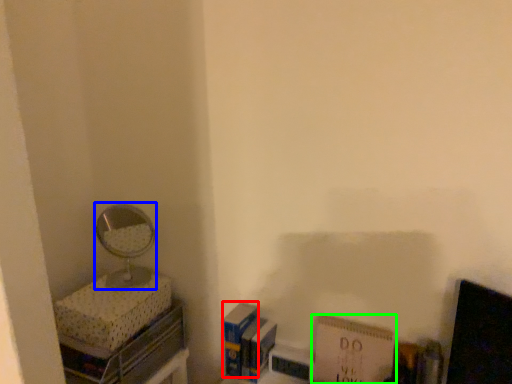
Question: Which object is the farthest from paperback book (highlighted by a red box)? Choose among these: mirror (highlighted by a blue box) or paperback book (highlighted by a green box).

Choices:
 (A) mirror
 (B) paperback book

Answer: (A)